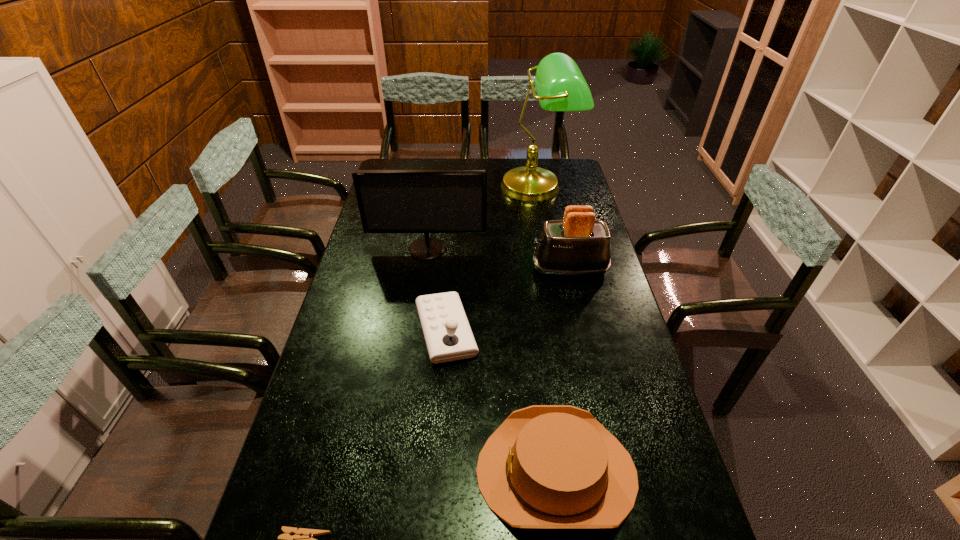
Find the location of a particular element. This screenshot has height=540, width=960. vacant space situated 0.400m on the side of the toaster with the control lever is located at coordinates (419, 269).

I want to click on free space located on the side of the toaster with the control lever, so click(x=439, y=269).

Locate an element on the screen. This screenshot has width=960, height=540. free space located on the back of the joystick is located at coordinates (452, 249).

Image resolution: width=960 pixels, height=540 pixels. Identify the location of vacant space located 0.210m on the front-facing side of the cowboy hat. (387, 471).

At what (x,y) coordinates should I click in order to perform the action: click on free region located 0.340m on the front-facing side of the cowboy hat. Please return your answer as a coordinate pair (x, y). This screenshot has width=960, height=540. Looking at the image, I should click on (330, 471).

Where is `vacant space situated 0.290m on the front-facing side of the cowboy hat`? This screenshot has width=960, height=540. vacant space situated 0.290m on the front-facing side of the cowboy hat is located at coordinates (352, 471).

This screenshot has height=540, width=960. What are the coordinates of `object located in the far edge section of the desktop` in the screenshot? It's located at (560, 86).

Identify the location of object at the left edge. The height and width of the screenshot is (540, 960). (390, 201).

This screenshot has width=960, height=540. Find the location of `lamp located in the right edge section of the desktop`. lamp located in the right edge section of the desktop is located at coordinates point(560,86).

Locate an element on the screen. The width and height of the screenshot is (960, 540). toaster that is positioned at the right edge is located at coordinates (578, 245).